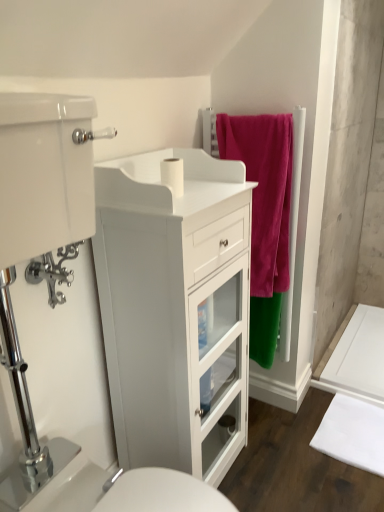
I want to click on white matte toilet paper at center, so click(173, 175).

What do you see at coordinates (114, 490) in the screenshot? I see `white glossy sink at lower center` at bounding box center [114, 490].

Locate an element on the screen. Image resolution: width=384 pixels, height=512 pixels. white matte toilet paper at center is located at coordinates (173, 175).

Is white fabric bath mat at lower right positioned with its back to white glossy sink at lower center?

No, white fabric bath mat at lower right is not facing the opposite direction of white glossy sink at lower center.

In terms of width, does white fabric bath mat at lower right look wider or thinner when compared to white glossy sink at lower center?

Considering their sizes, white fabric bath mat at lower right looks slimmer than white glossy sink at lower center.

This screenshot has width=384, height=512. Find the location of `sink on the left of white fabric bath mat at lower right`. sink on the left of white fabric bath mat at lower right is located at coordinates (114, 490).

Is there a large distance between white fabric bath mat at lower right and white glossy sink at lower center?

No.

Considering the sizes of objects velvet pink towel at upper right and white glossy sink at lower center in the image provided, who is bigger, velvet pink towel at upper right or white glossy sink at lower center?

white glossy sink at lower center is bigger.

Is velvet pink towel at upper right looking in the opposite direction of white glossy sink at lower center?

No.

Would you say velvet pink towel at upper right is to the left or to the right of white glossy sink at lower center in the picture?

velvet pink towel at upper right is positioned on white glossy sink at lower center's right side.

Which object is thinner, white glossy cabinet at left or white glossy sink at lower center?

white glossy cabinet at left is thinner.

From the image's perspective, is white glossy cabinet at left on white glossy sink at lower center?

Correct, white glossy cabinet at left appears higher than white glossy sink at lower center in the image.

Is white glossy cabinet at left positioned beyond the bounds of white glossy sink at lower center?

Yes, white glossy cabinet at left is not within white glossy sink at lower center.

Is white glossy cabinet at left bigger or smaller than white glossy sink at lower center?

In the image, white glossy cabinet at left appears to be larger than white glossy sink at lower center.

Is white glossy cabinet at left completely or partially outside of white matte toilet paper at center?

Yes, white glossy cabinet at left is outside of white matte toilet paper at center.

Considering the relative sizes of white glossy cabinet at left and white matte toilet paper at center in the image provided, is white glossy cabinet at left bigger than white matte toilet paper at center?

Indeed, white glossy cabinet at left has a larger size compared to white matte toilet paper at center.

Is there a large distance between white glossy cabinet at left and white matte toilet paper at center?

No, white glossy cabinet at left is not far away from white matte toilet paper at center.

Which of these two, white matte toilet paper at center or white glossy sink at lower center, is bigger?

white glossy sink at lower center.

Visually, is white matte toilet paper at center positioned to the left or to the right of white glossy sink at lower center?

Clearly, white matte toilet paper at center is on the right of white glossy sink at lower center in the image.

Which object is more forward, white matte toilet paper at center or white glossy sink at lower center?

Positioned in front is white glossy sink at lower center.

Does white matte toilet paper at center have a greater width compared to white glossy sink at lower center?

Incorrect, the width of white matte toilet paper at center does not surpass that of white glossy sink at lower center.

Which is correct: white matte toilet paper at center is inside velvet pink towel at upper right, or outside of it?

white matte toilet paper at center is outside velvet pink towel at upper right.

From a real-world perspective, does white matte toilet paper at center sit lower than velvet pink towel at upper right?

No, from a real-world perspective, white matte toilet paper at center is not beneath velvet pink towel at upper right.

Considering the positions of objects white matte toilet paper at center and velvet pink towel at upper right in the image provided, who is behind, white matte toilet paper at center or velvet pink towel at upper right?

Positioned behind is velvet pink towel at upper right.

From the image's perspective, which one is positioned lower, white matte toilet paper at center or velvet pink towel at upper right?

velvet pink towel at upper right.

Is point (69, 505) closer to viewer compared to point (334, 420)?

That is True.

Which is more to the left, white glossy sink at lower center or white fabric bath mat at lower right?

white glossy sink at lower center is more to the left.

Is white glossy sink at lower center aimed at white fabric bath mat at lower right?

No, white glossy sink at lower center is not aimed at white fabric bath mat at lower right.

In the image, is white glossy sink at lower center positioned in front of or behind white fabric bath mat at lower right?

white glossy sink at lower center is in front of white fabric bath mat at lower right.

Where is `sink on the left of white fabric bath mat at lower right`? sink on the left of white fabric bath mat at lower right is located at coordinates tap(114, 490).

Find the location of a particular element. bath towel that is on the right side of white glossy sink at lower center is located at coordinates (264, 216).

When comparing their distances from white matte toilet paper at center, does velvet pink towel at upper right or white fabric bath mat at lower right seem closer?

Among the two, velvet pink towel at upper right is located nearer to white matte toilet paper at center.

Which object lies nearer to the anchor point white matte toilet paper at center, white glossy cabinet at left or velvet pink towel at upper right?

white glossy cabinet at left lies closer to white matte toilet paper at center than the other object.

In the scene shown: When comparing their distances from velvet pink towel at upper right, does white glossy sink at lower center or white matte toilet paper at center seem further?

Based on the image, white glossy sink at lower center appears to be further to velvet pink towel at upper right.

Which object lies nearer to the anchor point white fabric bath mat at lower right, white glossy cabinet at left or white glossy sink at lower center?

The object closer to white fabric bath mat at lower right is white glossy cabinet at left.

Which object lies further to the anchor point white matte toilet paper at center, velvet pink towel at upper right or white glossy cabinet at left?

velvet pink towel at upper right lies further to white matte toilet paper at center than the other object.

Which object lies further to the anchor point white glossy sink at lower center, velvet pink towel at upper right or white glossy cabinet at left?

Based on the image, velvet pink towel at upper right appears to be further to white glossy sink at lower center.

Estimate the real-world distances between objects in this image. Which object is closer to white glossy sink at lower center, white matte toilet paper at center or white glossy cabinet at left?

The object closer to white glossy sink at lower center is white glossy cabinet at left.

Considering their positions, is white fabric bath mat at lower right positioned closer to white matte toilet paper at center than velvet pink towel at upper right?

velvet pink towel at upper right.

The image size is (384, 512). I want to click on bathroom cabinet between white matte toilet paper at center and white glossy sink at lower center vertically, so click(174, 307).

Identify the location of bath towel between white matte toilet paper at center and white glossy cabinet at left in the vertical direction. The width and height of the screenshot is (384, 512). (264, 216).

The height and width of the screenshot is (512, 384). I want to click on bath towel between white matte toilet paper at center and white fabric bath mat at lower right vertically, so click(264, 216).

Image resolution: width=384 pixels, height=512 pixels. I want to click on bathroom cabinet that lies between velvet pink towel at upper right and white glossy sink at lower center from top to bottom, so click(174, 307).